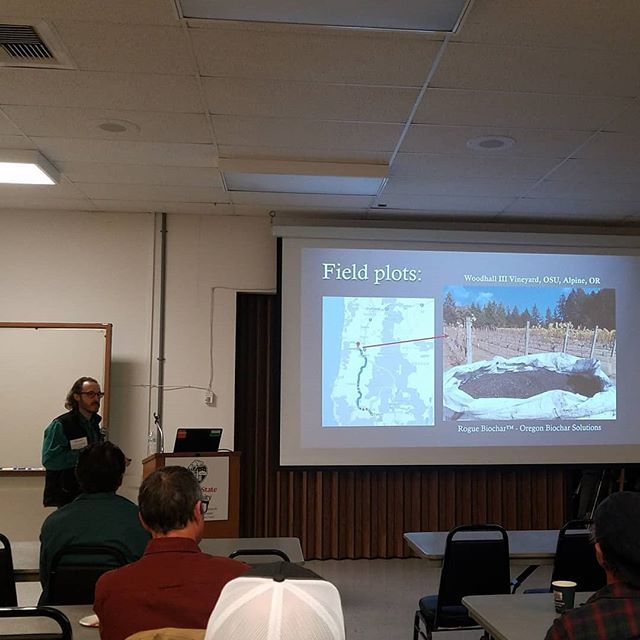
Identify the location of white table on left side of room - right chair top. This screenshot has height=640, width=640. (272, 554).